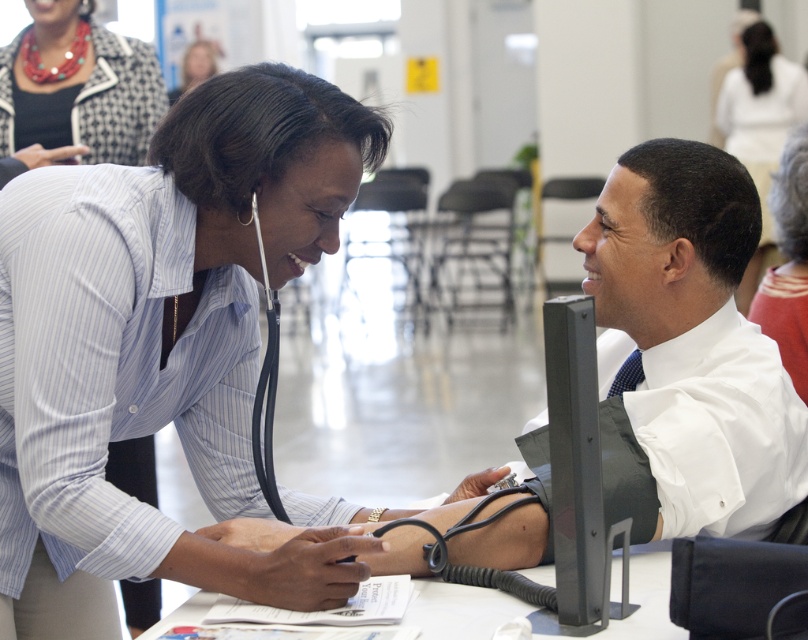
You are a photographer setting up for a group photo at this event. You need to ensure that all subjects are visible in the frame. Considering the matte black necklace at upper left and the smooth skin face at upper center, which object could potentially block the view of the other if positioned too closely?

The matte black necklace at upper left might block the view of the smooth skin face at upper center because it is wider than the smooth skin face at upper center.

You are standing in the medical consultation area and need to reach a specific location. You see two points marked in the scene. Which point, point (x=188, y=150) or point (x=787, y=310), is closer to you?

Point (x=188, y=150) is closer to the camera than point (x=787, y=310), so it is the closer point.